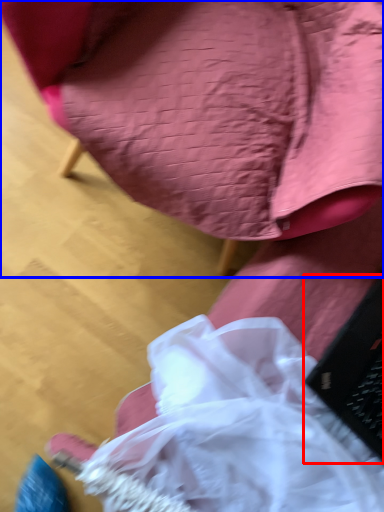
Question: Which of the following is the closest to the observer, laptop (highlighted by a red box) or chair (highlighted by a blue box)?

Choices:
 (A) laptop
 (B) chair

Answer: (B)